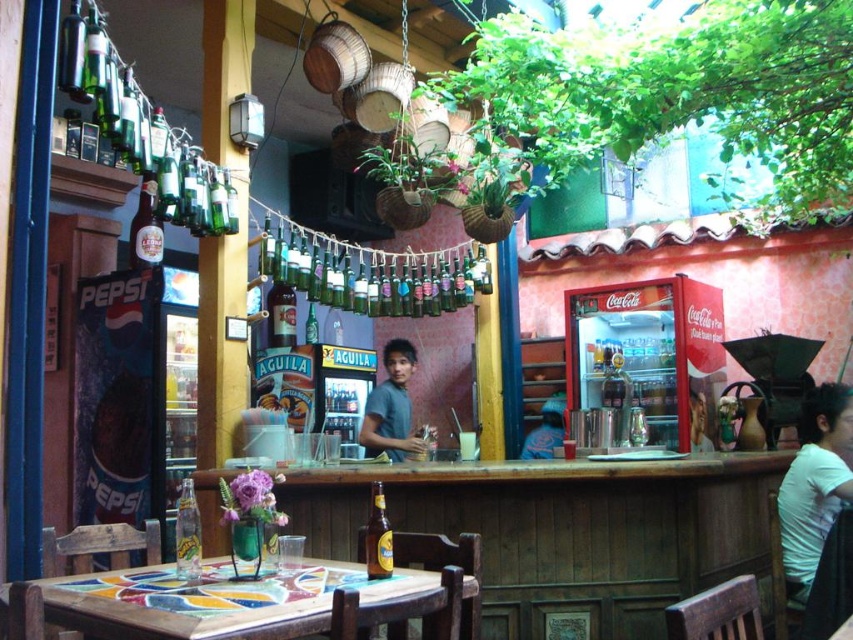
Question: Is translucent glass bottle at table center further to the viewer compared to blue denim jacket at center?

Choices:
 (A) no
 (B) yes

Answer: (A)

Question: Among these points, which one is farthest from the camera?

Choices:
 (A) (374, 513)
 (B) (447, 586)
 (C) (86, 42)

Answer: (C)

Question: Is wooden mosaic table at center wider than white cotton shirt at lower right?

Choices:
 (A) yes
 (B) no

Answer: (A)

Question: Is translucent glass bottle at table center closer to the viewer compared to blue denim jacket at center?

Choices:
 (A) no
 (B) yes

Answer: (B)

Question: Which object is the closest to the wooden mosaic table at center?

Choices:
 (A) green glass bottle at center
 (B) translucent glass bottle at table center
 (C) blue denim jacket at center

Answer: (B)

Question: Among these points, which one is nearest to the camera?

Choices:
 (A) (392, 461)
 (B) (198, 513)
 (C) (795, 476)
 (D) (125, 582)

Answer: (D)